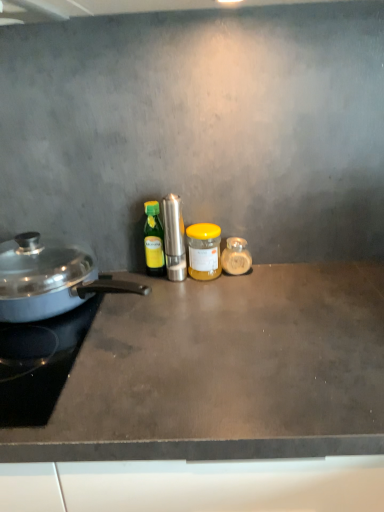
This screenshot has width=384, height=512. What are the coordinates of `vacant region to the left of yellow matte jar at center, arranged as the 2th kitchen appliance when viewed from the right` in the screenshot? It's located at (135, 290).